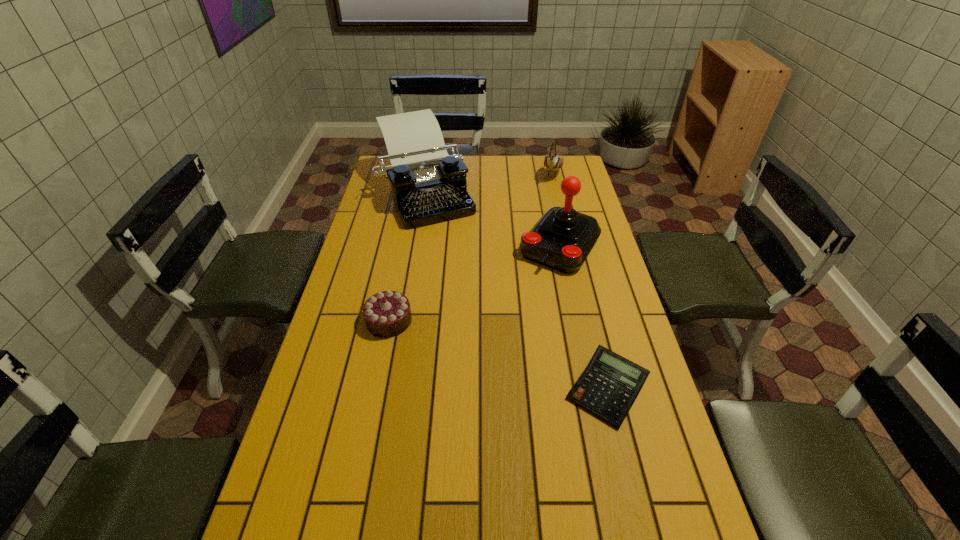
This screenshot has height=540, width=960. Find the location of `chocolate cake located at the left edge`. chocolate cake located at the left edge is located at coordinates (x=386, y=314).

What are the coordinates of `typewriter at the left edge` in the screenshot? It's located at (429, 186).

This screenshot has width=960, height=540. Find the location of `calculator at the right edge`. calculator at the right edge is located at coordinates tap(608, 387).

Identify the location of bird that is at the right edge. (552, 162).

Find the location of a particular element. joystick at the right edge is located at coordinates (562, 238).

The image size is (960, 540). Find the location of `object that is positioned at the far left corner`. object that is positioned at the far left corner is located at coordinates (429, 186).

In order to click on object at the far right corner in this screenshot , I will do `click(552, 162)`.

I want to click on free region at the near edge of the desktop, so click(523, 528).

Identify the location of free location at the left edge. (359, 250).

Where is `vacant space at the right edge`? The image size is (960, 540). vacant space at the right edge is located at coordinates (624, 319).